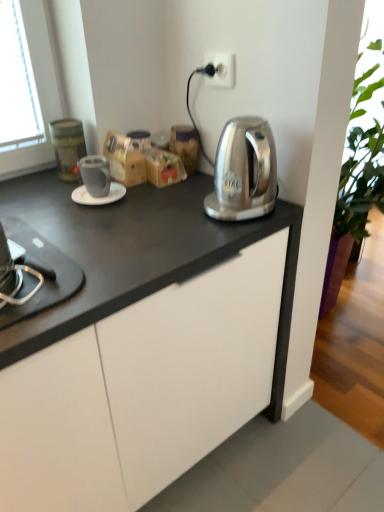
Question: Considering the relative sizes of brown cardboard box at center and brown paper bag at center, arranged as the first cabinetry when viewed from the back, in the image provided, is brown cardboard box at center thinner than brown paper bag at center, arranged as the first cabinetry when viewed from the back,?

Choices:
 (A) no
 (B) yes

Answer: (A)

Question: From the image's perspective, is brown cardboard box at center over brown paper bag at center, the second cabinetry when ordered from left to right?

Choices:
 (A) yes
 (B) no

Answer: (A)

Question: From the image's perspective, would you say brown cardboard box at center is shown under brown paper bag at center, the second cabinetry when ordered from left to right?

Choices:
 (A) no
 (B) yes

Answer: (A)

Question: Is the position of brown cardboard box at center more distant than that of brown paper bag at center, positioned as the 2th cabinetry in front-to-back order?

Choices:
 (A) yes
 (B) no

Answer: (A)

Question: Does brown cardboard box at center have a smaller size compared to brown paper bag at center, the first cabinetry positioned from the right?

Choices:
 (A) yes
 (B) no

Answer: (B)

Question: Is brown cardboard box at center not near brown paper bag at center, the second cabinetry ordered from the bottom?

Choices:
 (A) yes
 (B) no

Answer: (B)

Question: Is black glass stovetop at lower left completely or partially inside white plastic electric outlet at upper center?

Choices:
 (A) no
 (B) yes

Answer: (A)

Question: Can you confirm if white plastic electric outlet at upper center is thinner than black glass stovetop at lower left?

Choices:
 (A) yes
 (B) no

Answer: (A)

Question: From a real-world perspective, is white plastic electric outlet at upper center on top of black glass stovetop at lower left?

Choices:
 (A) no
 (B) yes

Answer: (B)

Question: Is white plastic electric outlet at upper center closer to camera compared to black glass stovetop at lower left?

Choices:
 (A) no
 (B) yes

Answer: (A)

Question: From the image's perspective, would you say white plastic electric outlet at upper center is shown under black glass stovetop at lower left?

Choices:
 (A) yes
 (B) no

Answer: (B)

Question: From the image's perspective, does white plastic electric outlet at upper center appear higher than black glass stovetop at lower left?

Choices:
 (A) no
 (B) yes

Answer: (B)

Question: Can you confirm if white glossy saucer at center is smaller than white plastic electric outlet at upper center?

Choices:
 (A) yes
 (B) no

Answer: (B)